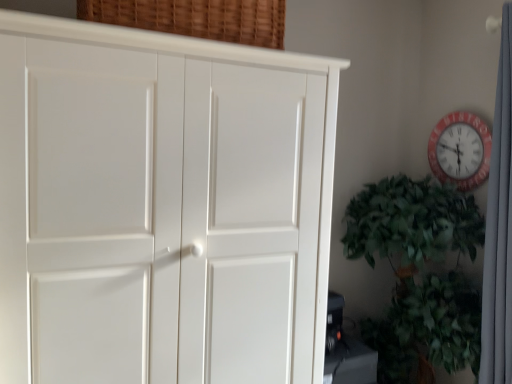
Question: From the image's perspective, is red plastic wall clock at upper right located above white fabric curtain at right?

Choices:
 (A) yes
 (B) no

Answer: (A)

Question: Is red plastic wall clock at upper right positioned beyond the bounds of white fabric curtain at right?

Choices:
 (A) yes
 (B) no

Answer: (A)

Question: Is red plastic wall clock at upper right beside white fabric curtain at right?

Choices:
 (A) no
 (B) yes

Answer: (A)

Question: Does red plastic wall clock at upper right lie behind white fabric curtain at right?

Choices:
 (A) no
 (B) yes

Answer: (B)

Question: Considering the relative sizes of red plastic wall clock at upper right and white fabric curtain at right in the image provided, is red plastic wall clock at upper right thinner than white fabric curtain at right?

Choices:
 (A) no
 (B) yes

Answer: (B)

Question: Is there a large distance between red plastic wall clock at upper right and white fabric curtain at right?

Choices:
 (A) yes
 (B) no

Answer: (B)

Question: Are red plastic wall clock at upper right and white matte cupboard at left beside each other?

Choices:
 (A) yes
 (B) no

Answer: (B)

Question: Does red plastic wall clock at upper right have a smaller size compared to white matte cupboard at left?

Choices:
 (A) no
 (B) yes

Answer: (B)

Question: From the image's perspective, is red plastic wall clock at upper right below white matte cupboard at left?

Choices:
 (A) no
 (B) yes

Answer: (A)

Question: Would you say white matte cupboard at left is part of red plastic wall clock at upper right's contents?

Choices:
 (A) yes
 (B) no

Answer: (B)

Question: Does red plastic wall clock at upper right have a greater width compared to white matte cupboard at left?

Choices:
 (A) yes
 (B) no

Answer: (B)

Question: Can you confirm if red plastic wall clock at upper right is positioned to the right of white matte cupboard at left?

Choices:
 (A) yes
 (B) no

Answer: (A)

Question: Can you confirm if white fabric curtain at right is shorter than red plastic wall clock at upper right?

Choices:
 (A) no
 (B) yes

Answer: (A)